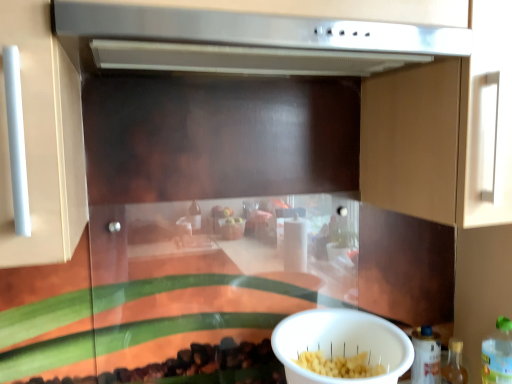
Question: Could white plastic bowl at lower center be considered to be inside stainless steel vent at upper center?

Choices:
 (A) no
 (B) yes

Answer: (A)

Question: Considering the relative sizes of stainless steel vent at upper center and white plastic bowl at lower center in the image provided, is stainless steel vent at upper center thinner than white plastic bowl at lower center?

Choices:
 (A) yes
 (B) no

Answer: (B)

Question: Does stainless steel vent at upper center have a lesser height compared to white plastic bowl at lower center?

Choices:
 (A) no
 (B) yes

Answer: (B)

Question: Is stainless steel vent at upper center bigger than white plastic bowl at lower center?

Choices:
 (A) no
 (B) yes

Answer: (B)

Question: Could you tell me if stainless steel vent at upper center is facing white plastic bowl at lower center?

Choices:
 (A) yes
 (B) no

Answer: (B)

Question: Does stainless steel vent at upper center have a greater width compared to white plastic bowl at lower center?

Choices:
 (A) no
 (B) yes

Answer: (B)

Question: Is translucent plastic bottle at lower right, the 1th bottle from the right, oriented towards white plastic bowl at lower center?

Choices:
 (A) yes
 (B) no

Answer: (B)

Question: From the image's perspective, is translucent plastic bottle at lower right, the third bottle from the left, over white plastic bowl at lower center?

Choices:
 (A) yes
 (B) no

Answer: (B)

Question: Considering the relative sizes of translucent plastic bottle at lower right, the third bottle from the left, and white plastic bowl at lower center in the image provided, is translucent plastic bottle at lower right, the third bottle from the left, shorter than white plastic bowl at lower center?

Choices:
 (A) no
 (B) yes

Answer: (A)

Question: Is translucent plastic bottle at lower right, the 1th bottle from the right, directly adjacent to white plastic bowl at lower center?

Choices:
 (A) no
 (B) yes

Answer: (A)

Question: Is translucent plastic bottle at lower right, the third bottle from the left, positioned far away from white plastic bowl at lower center?

Choices:
 (A) yes
 (B) no

Answer: (B)

Question: Considering the relative sizes of translucent plastic bottle at lower right, the 1th bottle from the right, and white plastic bowl at lower center in the image provided, is translucent plastic bottle at lower right, the 1th bottle from the right, wider than white plastic bowl at lower center?

Choices:
 (A) no
 (B) yes

Answer: (A)

Question: Is translucent plastic bottle at lower right, the third bottle in the right-to-left sequence, positioned far away from stainless steel vent at upper center?

Choices:
 (A) no
 (B) yes

Answer: (A)